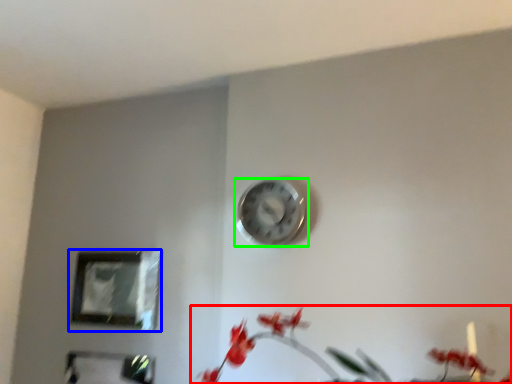
Question: Based on their relative distances, which object is farther from floral arrangement (highlighted by a red box)? Choose from picture frame (highlighted by a blue box) and wall clock (highlighted by a green box).

Choices:
 (A) picture frame
 (B) wall clock

Answer: (A)